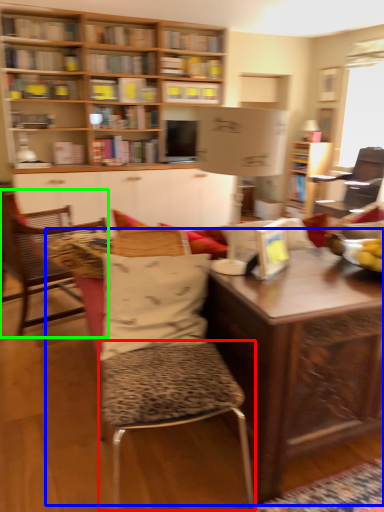
Question: Which is farther away from bar stool (highlighted by a red box)? table (highlighted by a blue box) or chair (highlighted by a green box)?

Choices:
 (A) table
 (B) chair

Answer: (B)